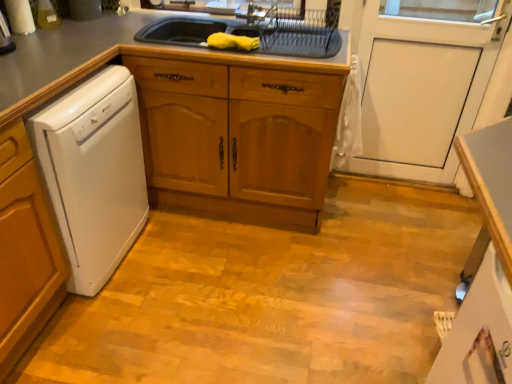
Question: From the image's perspective, is white matte door at center located above or below metallic silver faucet at upper center?

Choices:
 (A) above
 (B) below

Answer: (B)

Question: Is white matte door at center bigger or smaller than metallic silver faucet at upper center?

Choices:
 (A) big
 (B) small

Answer: (A)

Question: Which of these objects is positioned closest to the metallic silver faucet at upper center?

Choices:
 (A) white glossy counter at lower right
 (B) white matte door at center
 (C) white plastic dishwasher at left
 (D) gray matte countertop at upper center

Answer: (B)

Question: Which object is positioned farthest from the white plastic dishwasher at left?

Choices:
 (A) white glossy counter at lower right
 (B) metallic silver faucet at upper center
 (C) gray matte countertop at upper center
 (D) white matte door at center

Answer: (D)